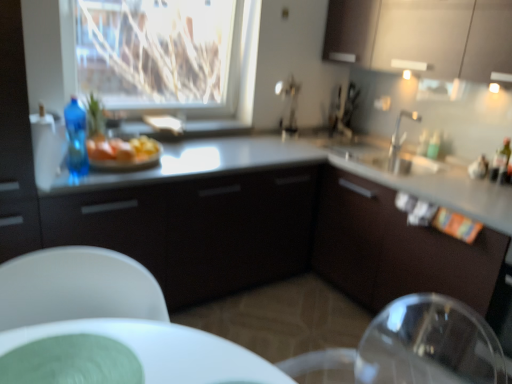
Question: From a real-world perspective, is transparent glass window at upper center positioned under blue plastic bottle at left based on gravity?

Choices:
 (A) yes
 (B) no

Answer: (B)

Question: Can you confirm if transparent glass window at upper center is wider than blue plastic bottle at left?

Choices:
 (A) yes
 (B) no

Answer: (A)

Question: Can you confirm if transparent glass window at upper center is smaller than blue plastic bottle at left?

Choices:
 (A) yes
 (B) no

Answer: (B)

Question: Is the depth of transparent glass window at upper center less than that of blue plastic bottle at left?

Choices:
 (A) yes
 (B) no

Answer: (B)

Question: Considering the relative sizes of transparent glass window at upper center and blue plastic bottle at left in the image provided, is transparent glass window at upper center thinner than blue plastic bottle at left?

Choices:
 (A) no
 (B) yes

Answer: (A)

Question: In terms of height, does blue plastic bottle at left look taller or shorter compared to matte white cabinets at upper right, which is the 2th cabinetry in left-to-right order?

Choices:
 (A) short
 (B) tall

Answer: (A)

Question: From a real-world perspective, relative to matte white cabinets at upper right, the second cabinetry ordered from the bottom, is blue plastic bottle at left vertically above or below?

Choices:
 (A) above
 (B) below

Answer: (B)

Question: Is blue plastic bottle at left in front of or behind matte white cabinets at upper right, which is the 2th cabinetry in left-to-right order, in the image?

Choices:
 (A) behind
 (B) front

Answer: (B)

Question: Would you say blue plastic bottle at left is inside or outside matte white cabinets at upper right, which ranks as the 1th cabinetry in right-to-left order?

Choices:
 (A) inside
 (B) outside

Answer: (B)

Question: In terms of size, does green matte plate at lower left appear bigger or smaller than silver metallic faucet at upper right?

Choices:
 (A) small
 (B) big

Answer: (A)

Question: In terms of height, does green matte plate at lower left look taller or shorter compared to silver metallic faucet at upper right?

Choices:
 (A) tall
 (B) short

Answer: (B)

Question: Which is correct: green matte plate at lower left is inside silver metallic faucet at upper right, or outside of it?

Choices:
 (A) outside
 (B) inside

Answer: (A)

Question: Does point tap(46, 380) appear closer or farther from the camera than point tap(398, 125)?

Choices:
 (A) farther
 (B) closer

Answer: (B)

Question: Based on their positions, is matte white cabinets at upper right, the second cabinetry ordered from the bottom, located to the left or right of matte black cabinet at center, the 1th cabinetry positioned from the bottom?

Choices:
 (A) right
 (B) left

Answer: (A)

Question: From a real-world perspective, is matte white cabinets at upper right, which is the 2th cabinetry in left-to-right order, physically located above or below matte black cabinet at center, which is the second cabinetry in right-to-left order?

Choices:
 (A) below
 (B) above

Answer: (B)